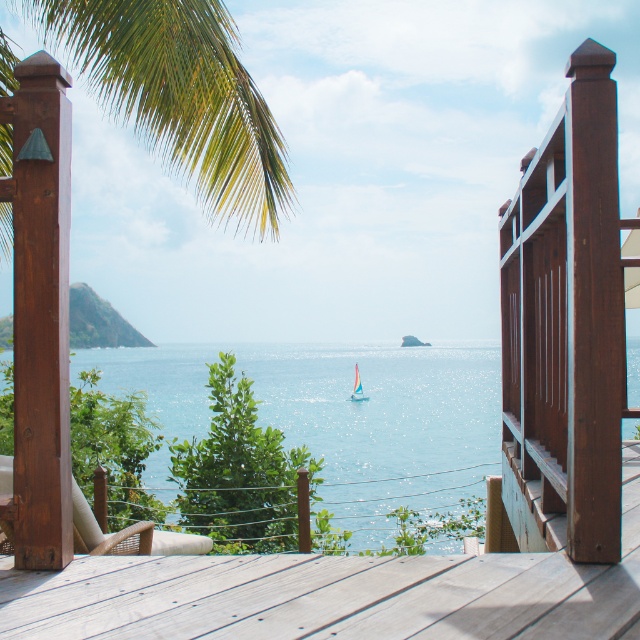
Question: Does wooden deck at center have a larger size compared to green leafy palm tree at upper left?

Choices:
 (A) yes
 (B) no

Answer: (A)

Question: Does blue water at center have a greater width compared to green leafy palm tree at upper left?

Choices:
 (A) no
 (B) yes

Answer: (B)

Question: Can you confirm if wooden deck at center is wider than pastel pink sailboat at center?

Choices:
 (A) no
 (B) yes

Answer: (B)

Question: Which object appears farthest from the camera in this image?

Choices:
 (A) blue water at center
 (B) wooden deck at center

Answer: (A)

Question: Which point is closer to the camera?

Choices:
 (A) pastel pink sailboat at center
 (B) green leafy palm tree at upper left

Answer: (B)

Question: Which object appears farthest from the camera in this image?

Choices:
 (A) blue water at center
 (B) green leafy palm tree at upper left

Answer: (A)